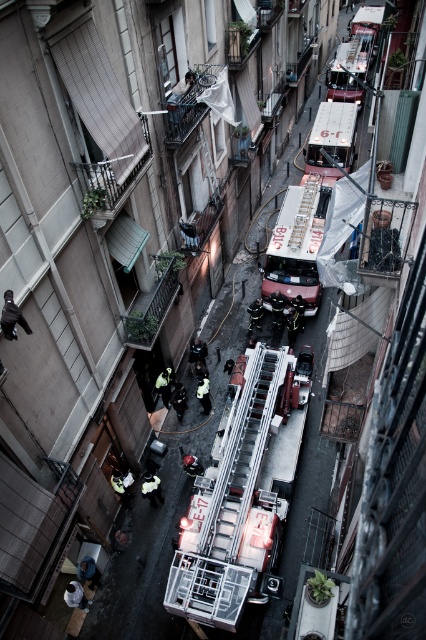
Question: Based on their relative distances, which object is nearer to the metallic silver ladder at center?

Choices:
 (A) metallic red fire truck at center
 (B) metallic silver fire truck at center

Answer: (A)

Question: Does metallic silver fire truck at center have a smaller size compared to metallic silver ladder at center?

Choices:
 (A) no
 (B) yes

Answer: (B)

Question: Which point is closer to the camera?

Choices:
 (A) metallic red fire truck at center
 (B) metallic silver fire truck at center

Answer: (B)

Question: Does metallic silver fire truck at center lie behind metallic silver ladder at center?

Choices:
 (A) yes
 (B) no

Answer: (B)

Question: Which object appears farthest from the camera in this image?

Choices:
 (A) metallic silver fire truck at center
 (B) metallic red fire truck at center

Answer: (B)

Question: In this image, where is metallic red fire truck at center located relative to metallic silver ladder at center?

Choices:
 (A) left
 (B) right

Answer: (B)